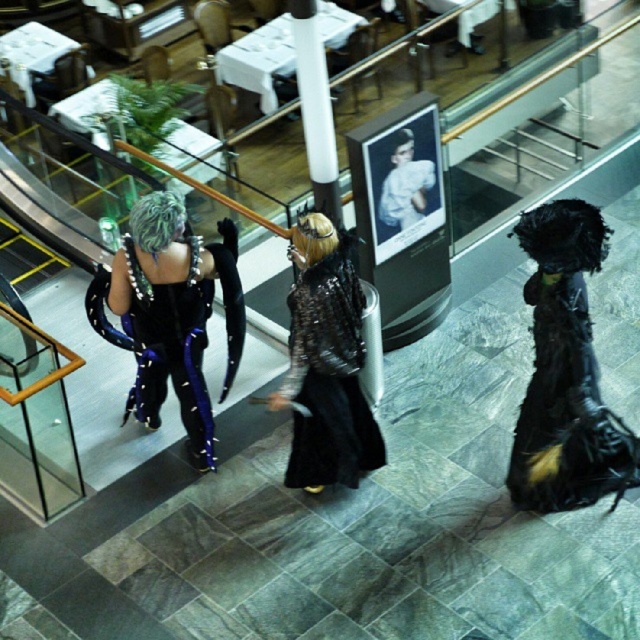
Is shiny black armor at left thinner than shiny silver armor at center?

Incorrect, shiny black armor at left's width is not less than shiny silver armor at center's.

Between point (188, 262) and point (353, 355), which one is positioned in front?

Point (353, 355)

Locate an element on the screen. shiny black armor at left is located at coordinates (170, 314).

Is shiny silver armor at center above shiny silver wig at upper left?

Actually, shiny silver armor at center is below shiny silver wig at upper left.

Can you confirm if shiny silver armor at center is wider than shiny silver wig at upper left?

Correct, the width of shiny silver armor at center exceeds that of shiny silver wig at upper left.

Where is `shiny silver armor at center`? The height and width of the screenshot is (640, 640). shiny silver armor at center is located at coordinates (326, 364).

Is shiny black armor at left thinner than black leather boots at right?

In fact, shiny black armor at left might be wider than black leather boots at right.

Image resolution: width=640 pixels, height=640 pixels. What are the coordinates of `shiny black armor at left` in the screenshot? It's located at (170, 314).